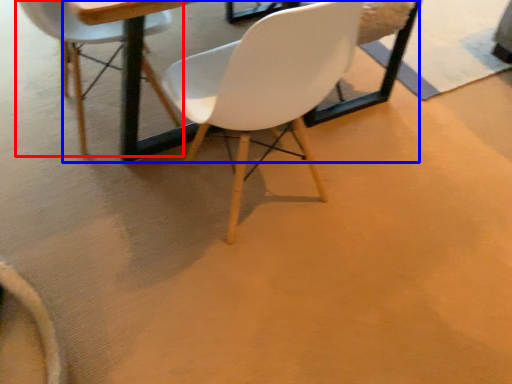
Question: Which object appears farthest to the camera in this image, chair (highlighted by a red box) or round table (highlighted by a blue box)?

Choices:
 (A) chair
 (B) round table

Answer: (A)